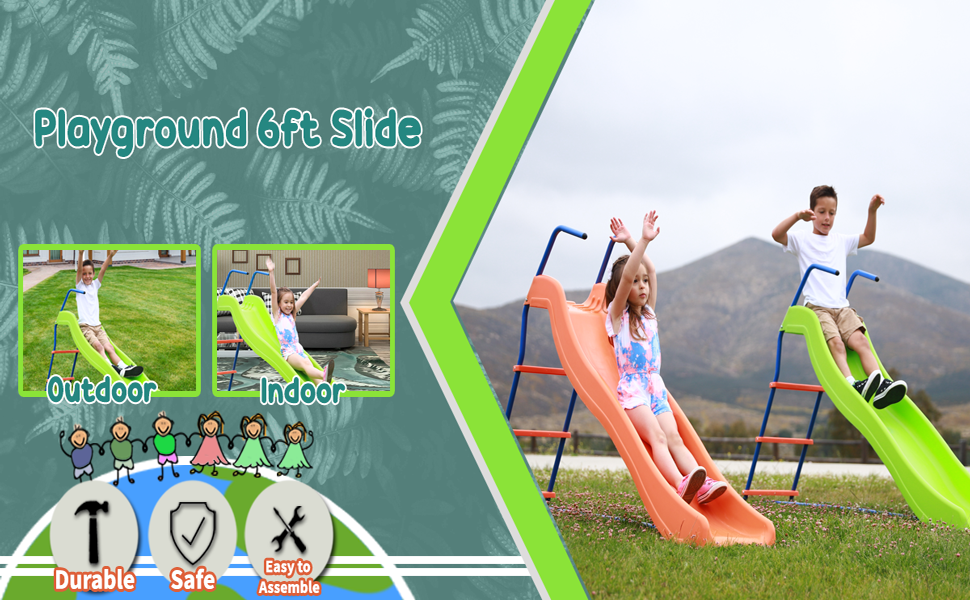
Locate an element on the screen. slide ladder is located at coordinates (55, 347), (233, 355), (570, 413), (766, 411).